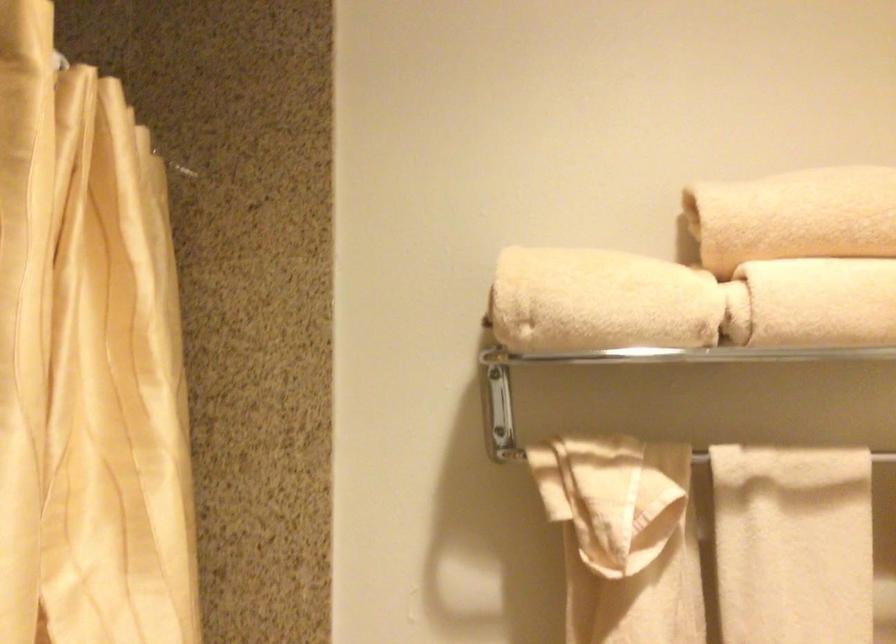
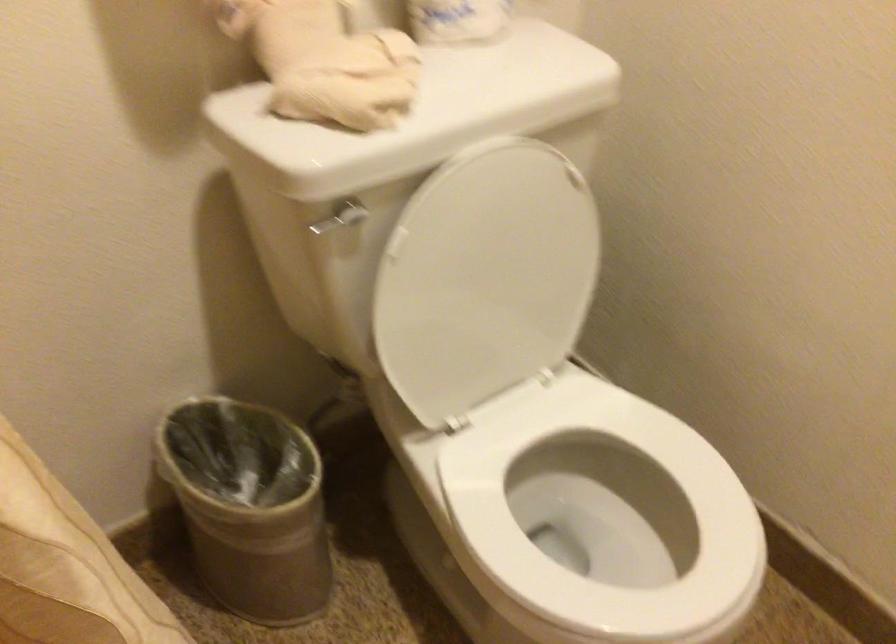
The first image is from the beginning of the video and the second image is from the end. How did the camera likely rotate when shooting the video?

The rotation direction of the camera is right-down.